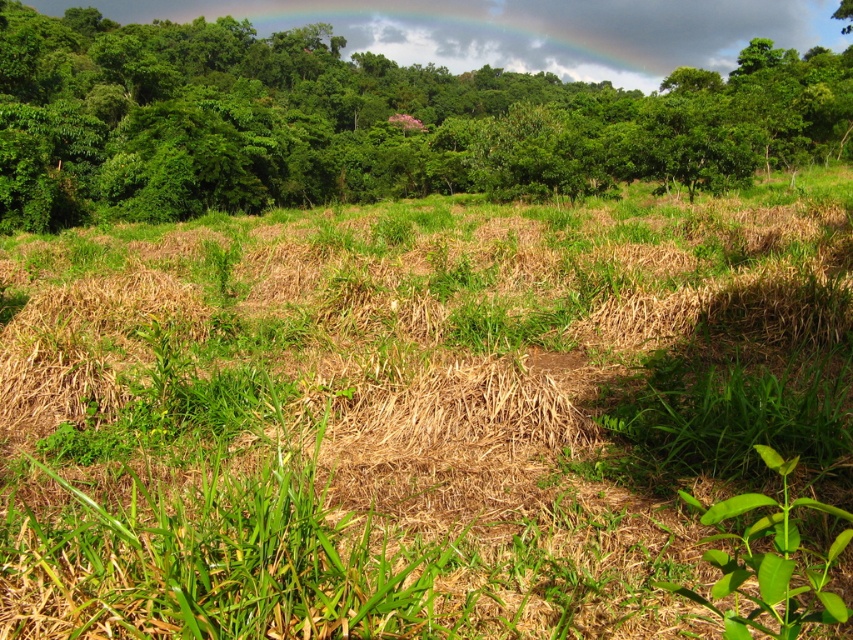
Question: Can you confirm if green grassy field at center is positioned above green leafy tree at upper center?

Choices:
 (A) no
 (B) yes

Answer: (A)

Question: Which point is closer to the camera?

Choices:
 (A) (198, 385)
 (B) (302, 177)

Answer: (A)

Question: Can you confirm if green grassy field at center is positioned above green leafy tree at upper center?

Choices:
 (A) yes
 (B) no

Answer: (B)

Question: From the image, what is the correct spatial relationship of green grassy field at center in relation to green leafy tree at upper center?

Choices:
 (A) below
 (B) above

Answer: (A)

Question: Which point appears farthest from the camera in this image?

Choices:
 (A) (73, 268)
 (B) (606, 134)

Answer: (B)

Question: Which of the following is the closest to the observer?

Choices:
 (A) (291, 362)
 (B) (30, 138)

Answer: (A)